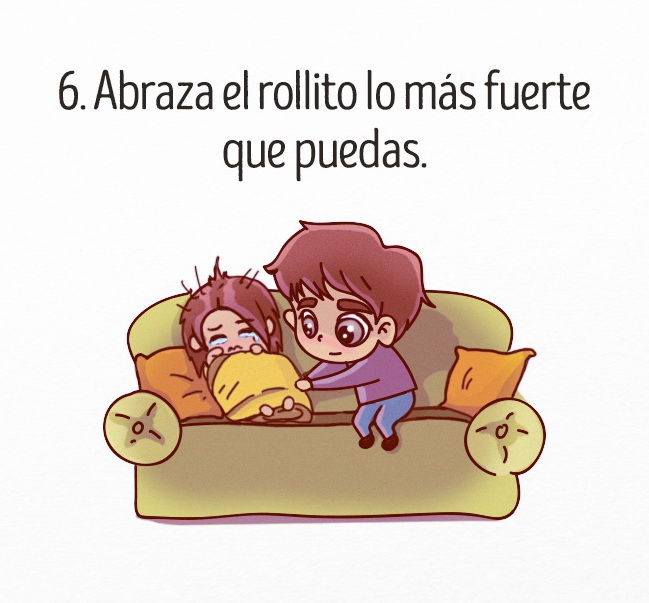
You are a GUI agent. You are given a task and a screenshot of the screen. Output one action in this format:
    pyautogui.click(x=<x>, y=<y>)
    Task: Click on the yellow blanket
    The width and height of the screenshot is (649, 603).
    Given the screenshot: What is the action you would take?
    pyautogui.click(x=262, y=368)